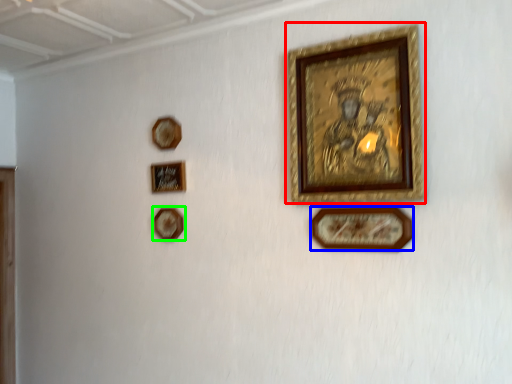
Question: Which object is the farthest from picture frame (highlighted by a red box)? Choose among these: picture frame (highlighted by a blue box) or picture frame (highlighted by a green box).

Choices:
 (A) picture frame
 (B) picture frame

Answer: (B)